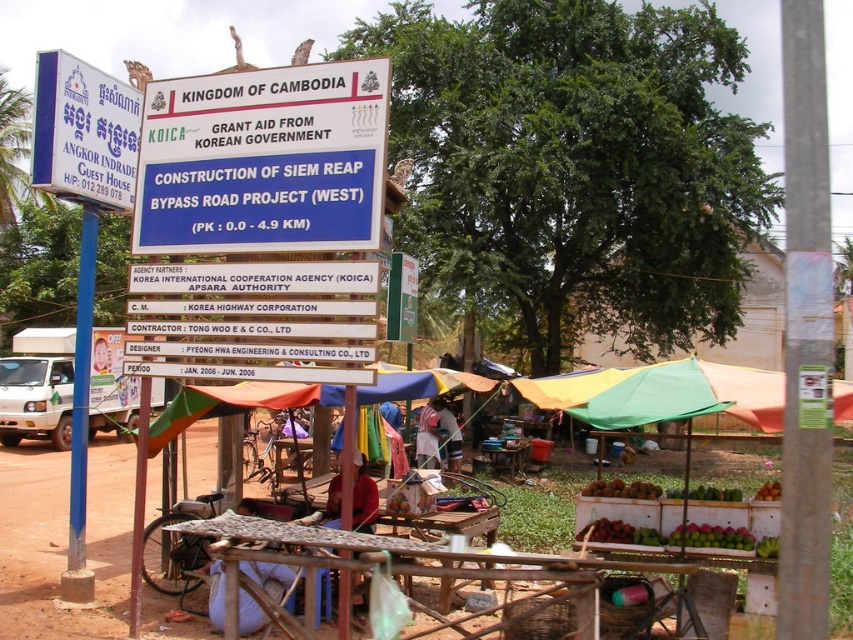
You are a construction worker standing at the origin point of the coordinate system. You need to locate the blue plastic sign at upper center. What are the coordinates where you can find it?

The blue plastic sign at upper center is located at coordinates point (263, 161).

You are a pedestrian standing in front of the blue painted metal pole at left and the blue plastic sign at upper center. Which object is taller?

The blue painted metal pole at left is taller than the blue plastic sign at upper center.

Based on the photo, you are a pedestrian walking towards the white plastic sign at upper left and the blue painted metal pole at left. Which object will you encounter first?

The white plastic sign at upper left is located above the blue painted metal pole at left, so you will encounter the blue painted metal pole at left first before reaching the sign.